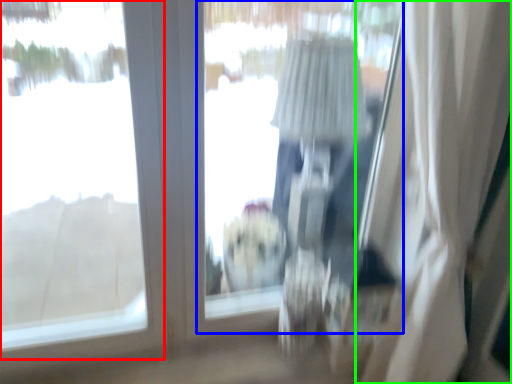
Question: Based on their relative distances, which object is farther from window (highlighted by a red box)? Choose from window screen (highlighted by a blue box) and curtain (highlighted by a green box).

Choices:
 (A) window screen
 (B) curtain

Answer: (B)